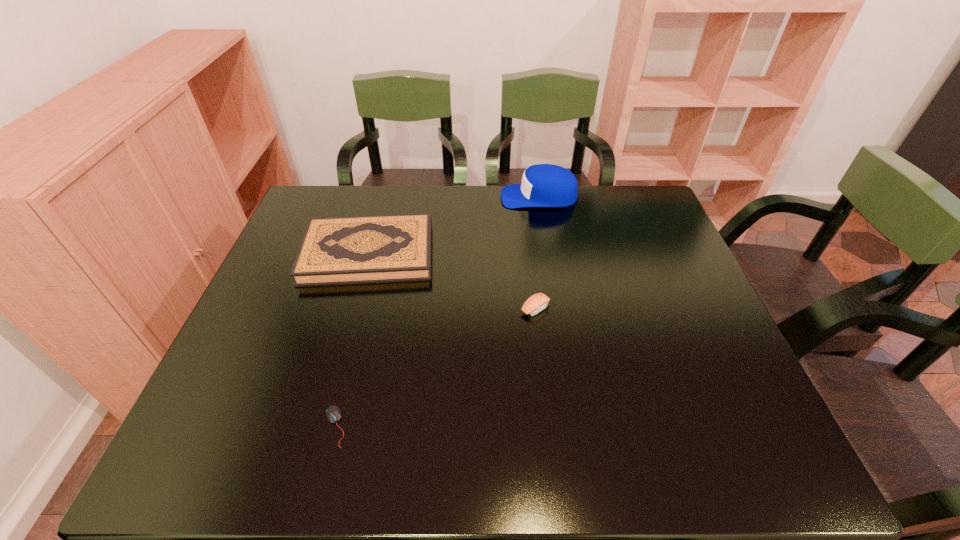
Where is `the tallest object`? Image resolution: width=960 pixels, height=540 pixels. the tallest object is located at coordinates (543, 185).

Locate an element on the screen. the farthest object is located at coordinates (543, 185).

Where is `the third shortest object`? the third shortest object is located at coordinates (365, 249).

The height and width of the screenshot is (540, 960). In order to click on hardback book in this screenshot , I will do tap(365, 249).

Where is `the second shortest object`? The height and width of the screenshot is (540, 960). the second shortest object is located at coordinates (538, 302).

Identify the location of sushi. (538, 302).

At what (x,y) coordinates should I click in order to perform the action: click on mouse. Please return your answer as a coordinate pair (x, y). This screenshot has width=960, height=540. Looking at the image, I should click on (333, 413).

Locate an element on the screen. The image size is (960, 540). the nearest object is located at coordinates 333,413.

Image resolution: width=960 pixels, height=540 pixels. In order to click on vacant space located on the front-facing side of the baseball cap in this screenshot , I will do pyautogui.click(x=465, y=197).

Where is `vacant space located 0.190m on the front-facing side of the baseball cap`? vacant space located 0.190m on the front-facing side of the baseball cap is located at coordinates (444, 197).